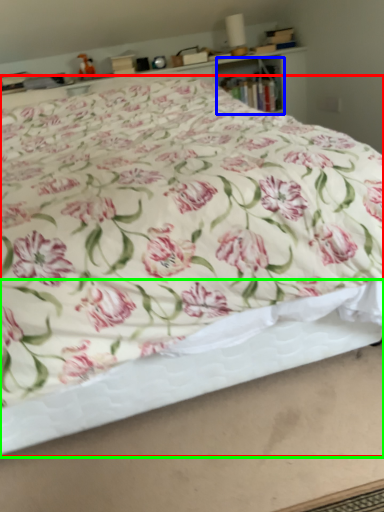
Question: Which is nearer to the bed (highlighted by a red box)? cabinet (highlighted by a blue box) or bed frame (highlighted by a green box).

Choices:
 (A) cabinet
 (B) bed frame

Answer: (B)